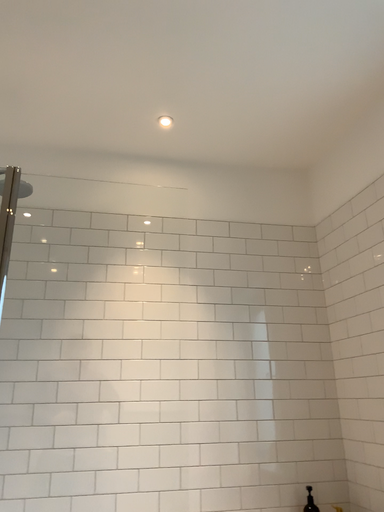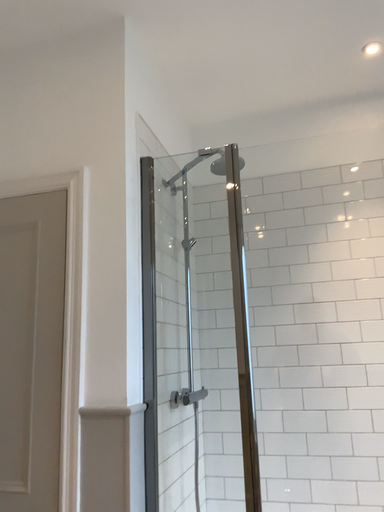
Question: Which way did the camera rotate in the video?

Choices:
 (A) rotated right
 (B) rotated left

Answer: (B)